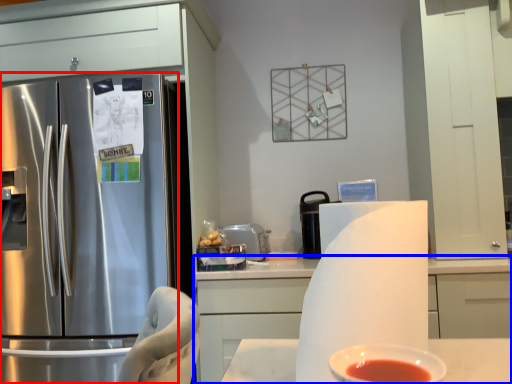
Question: Which point is closer to the camera, refrigerator (highlighted by a red box) or cabinetry (highlighted by a blue box)?

Choices:
 (A) refrigerator
 (B) cabinetry

Answer: (B)